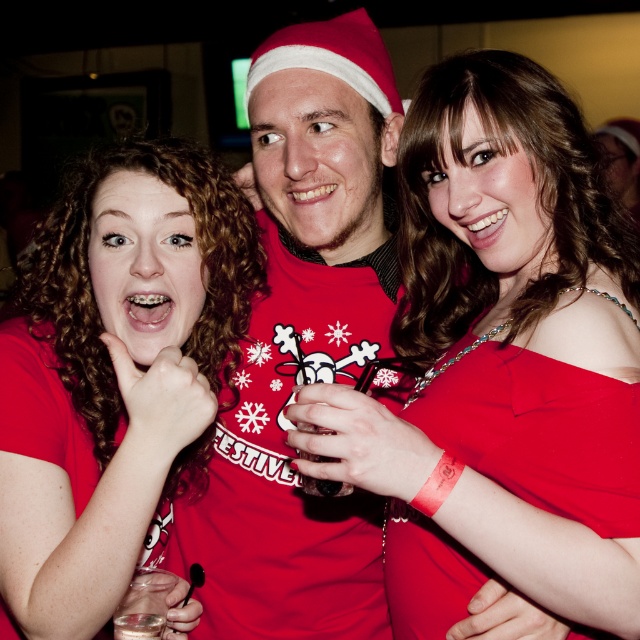
Between matte red dress at center and red satin dress at center, which one is positioned lower?

Positioned lower is red satin dress at center.

Who is taller, matte red dress at center or red satin dress at center?

With more height is matte red dress at center.

Is point (486, 138) positioned behind point (634, 525)?

Yes, point (486, 138) is behind point (634, 525).

I want to click on matte red dress at center, so click(x=502, y=362).

Can you confirm if matte red sweater at center is shorter than red satin dress at center?

No.

Who is lower down, matte red sweater at center or red satin dress at center?

Positioned lower is red satin dress at center.

Which is behind, point (387, 81) or point (604, 516)?

The point (387, 81) is behind.

Locate an element on the screen. This screenshot has height=640, width=640. matte red sweater at center is located at coordinates (300, 346).

In the scene shown: Is matte red dress at center to the right of matte red sweater at center from the viewer's perspective?

Correct, you'll find matte red dress at center to the right of matte red sweater at center.

Where is `matte red dress at center`? The width and height of the screenshot is (640, 640). matte red dress at center is located at coordinates coord(502,362).